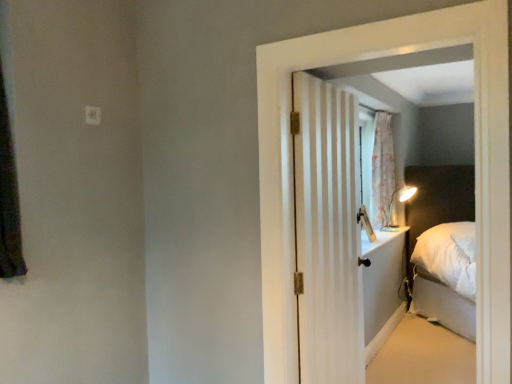
Question: Is white plastic electrical outlet at upper left inside or outside of white striped door at center?

Choices:
 (A) inside
 (B) outside

Answer: (B)

Question: From the image's perspective, is white plastic electrical outlet at upper left located above or below white striped door at center?

Choices:
 (A) above
 (B) below

Answer: (A)

Question: Relative to white striped door at center, is white plastic electrical outlet at upper left in front or behind?

Choices:
 (A) front
 (B) behind

Answer: (B)

Question: Do you think white striped door at center is within white plastic electrical outlet at upper left, or outside of it?

Choices:
 (A) outside
 (B) inside

Answer: (A)

Question: Considering the positions of white striped door at center and white plastic electrical outlet at upper left in the image, is white striped door at center wider or thinner than white plastic electrical outlet at upper left?

Choices:
 (A) thin
 (B) wide

Answer: (B)

Question: Considering the positions of white striped door at center and white plastic electrical outlet at upper left in the image, is white striped door at center bigger or smaller than white plastic electrical outlet at upper left?

Choices:
 (A) small
 (B) big

Answer: (B)

Question: From the image's perspective, is white striped door at center positioned above or below white plastic electrical outlet at upper left?

Choices:
 (A) above
 (B) below

Answer: (B)